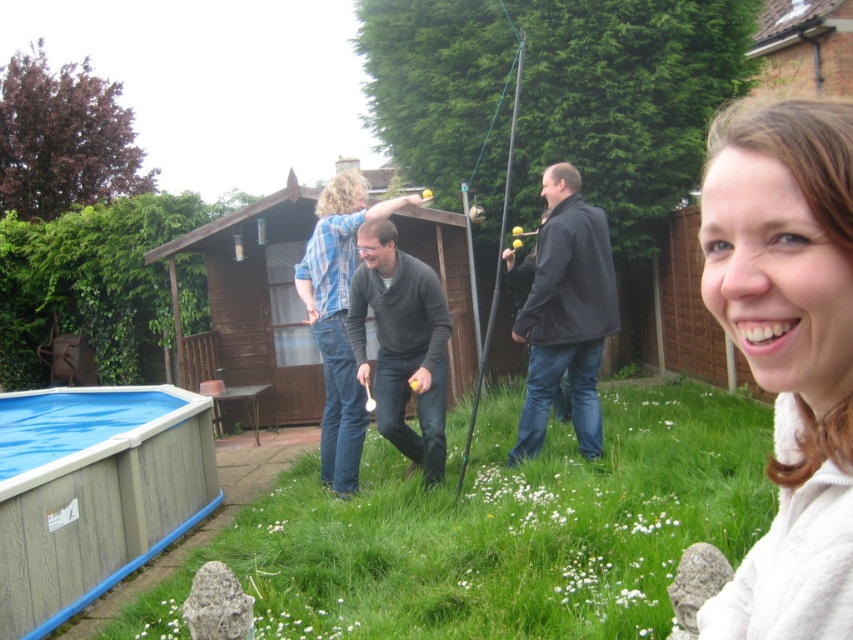
You are trying to decide which sweater to wear for a casual day outside. The white fleece sweater at upper right and the matte gray sweater at center are both options. Based on their sizes shown in the image, which one is taller?

The white fleece sweater at upper right is not as tall as the matte gray sweater at center, so the matte gray sweater at center is taller.

You are a drone operator trying to capture a photo of the backyard scene. The camera is currently positioned at point 0.5, 0.5. You want to adjust the camera to focus on the white fleece sweater at upper right. Which direction should you move the camera to get it centered?

The white fleece sweater at upper right is located at point (788,349). Since the camera is at (426,320), you need to move it slightly to the right and significantly upward to center the sweater.